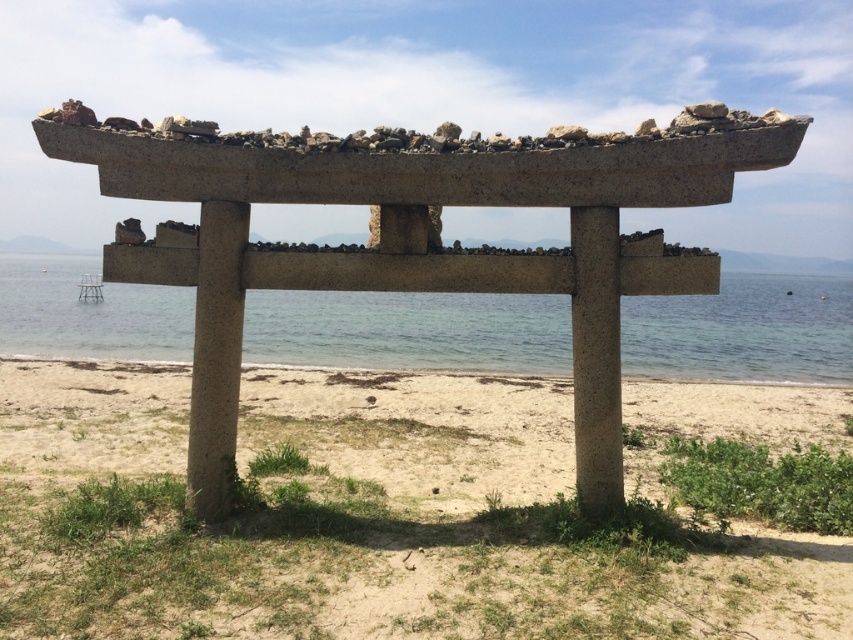
Question: Does light brown sandy beach at center appear over clear blue water at center?

Choices:
 (A) yes
 (B) no

Answer: (B)

Question: Which point is closer to the camera taking this photo?

Choices:
 (A) (85, 449)
 (B) (4, 285)

Answer: (A)

Question: Which of the following is the farthest from the observer?

Choices:
 (A) (440, 362)
 (B) (41, 371)

Answer: (A)

Question: Which of the following is the closest to the observer?

Choices:
 (A) (57, 344)
 (B) (434, 452)

Answer: (B)

Question: Can you confirm if light brown sandy beach at center is smaller than clear blue water at center?

Choices:
 (A) yes
 (B) no

Answer: (A)

Question: Is the position of light brown sandy beach at center less distant than that of clear blue water at center?

Choices:
 (A) yes
 (B) no

Answer: (A)